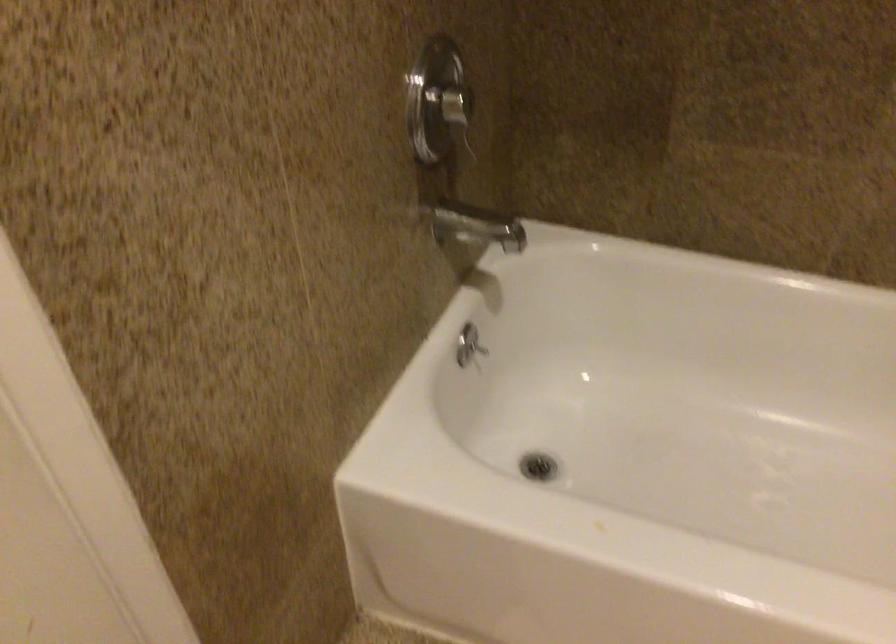
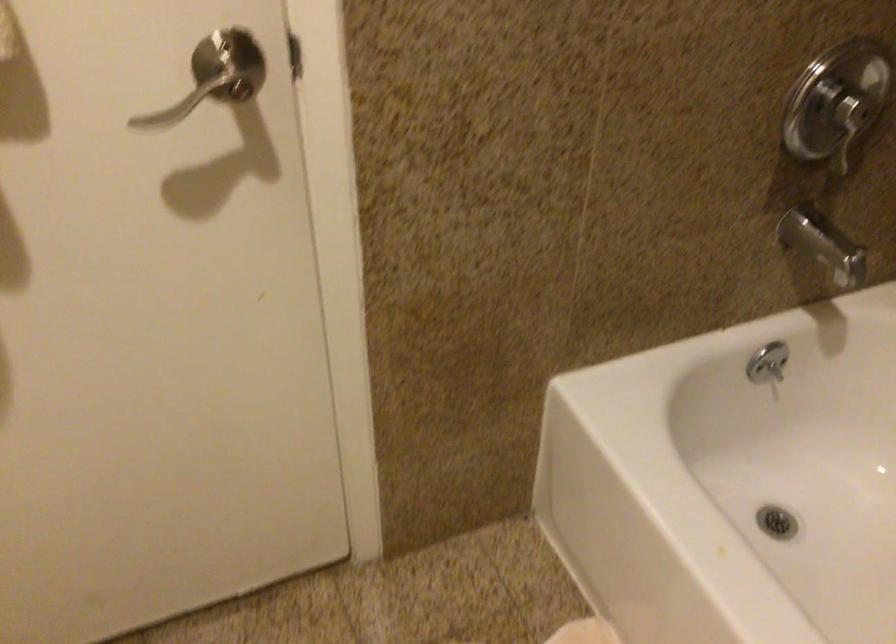
In the second image, find the point that corresponds to point 540,471 in the first image.

(776, 522)